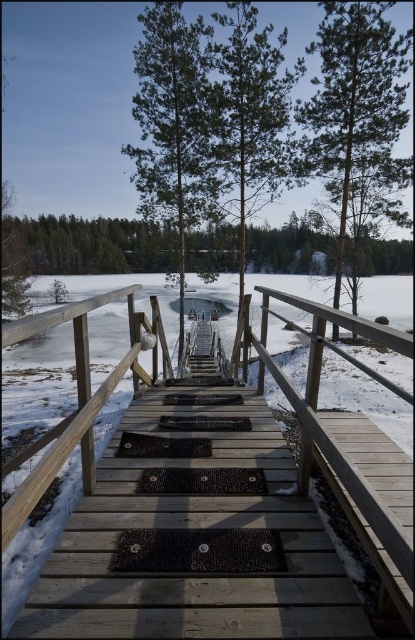
You are standing at the start of the walkway and want to reach the frozen lake. Which tree, the green textured pine tree at center or the green matte tree at center, would you pass closer to as you walk towards the lake?

The green textured pine tree at center is in front of the green matte tree at center, so you would pass closer to the green textured pine tree at center first as you walk towards the lake.

You are a winter hiker planning to cross the frozen lake. You see the wooden bridge at center and the green textured pine at center. Which object is closer to the frozen lake surface?

The wooden bridge at center is positioned under the green textured pine at center, meaning it is closer to the frozen lake surface.